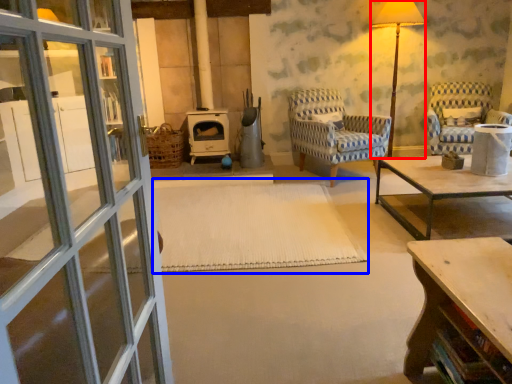
Question: Which of the following is the farthest to the observer, table lamp (highlighted by a red box) or mat (highlighted by a blue box)?

Choices:
 (A) table lamp
 (B) mat

Answer: (A)